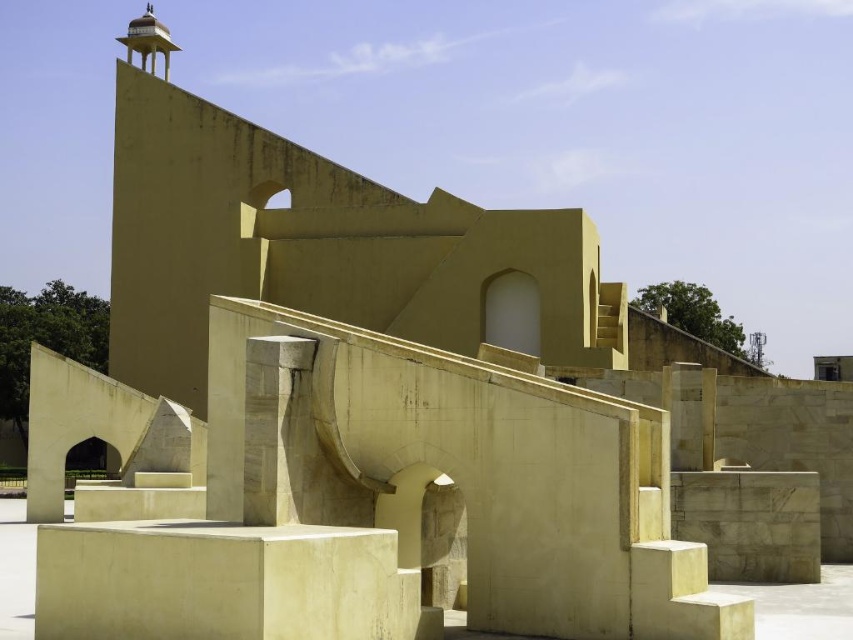
You are an architect visiting the Jantar Mantar observatory. You notice the gray concrete wall at center and the white marble pillar at center. Which object would require more material to construct, considering their sizes?

The gray concrete wall at center is larger in size than the white marble pillar at center, so it would require more material to construct.

You are standing at the entrance of the Jantar Mantar observatory and see the beige stone cube at center and the beige stone stairs at lower right. Which object is closer to you?

The beige stone cube at center is closer to you because it is in front of the beige stone stairs at lower right.